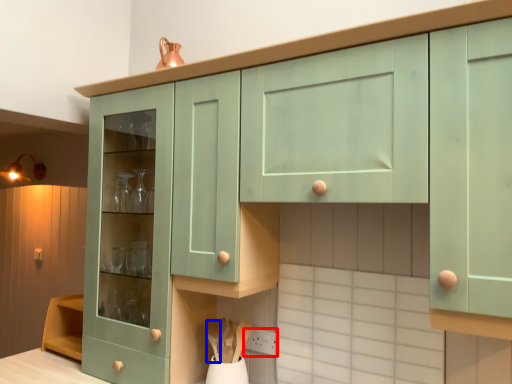
Question: Which of the following is the closest to the observer, power plugs and sockets (highlighted by a red box) or spoon (highlighted by a blue box)?

Choices:
 (A) power plugs and sockets
 (B) spoon

Answer: (B)